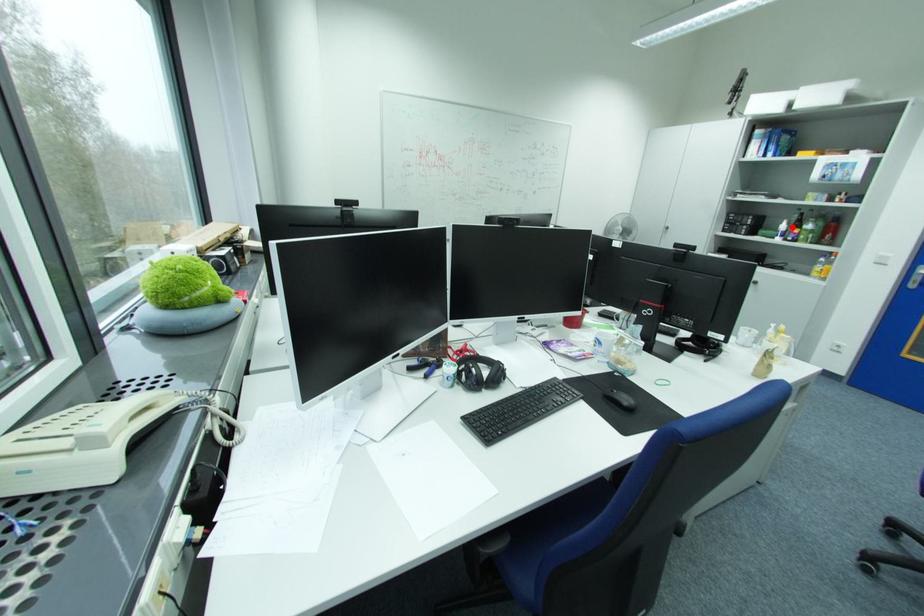
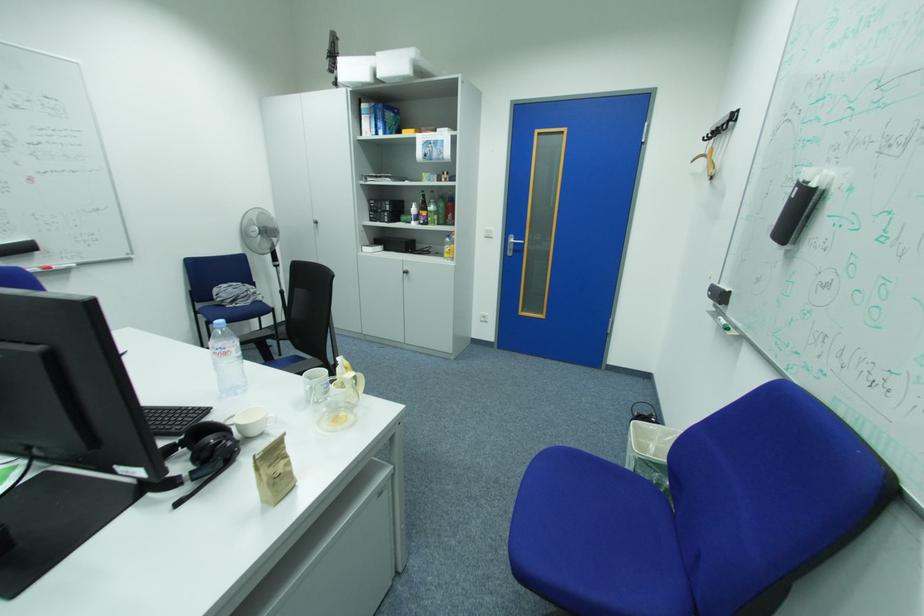
Find the pixel in the second image that matches the highlighted location in the first image.

(422, 211)